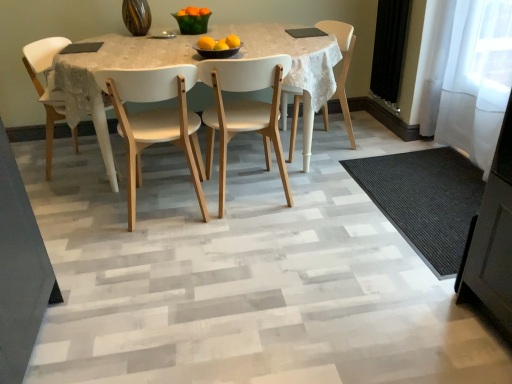
Question: Does point (218, 64) appear closer or farther from the camera than point (49, 107)?

Choices:
 (A) farther
 (B) closer

Answer: (B)

Question: Considering the positions of white wood chair at center, the third chair when ordered from left to right, and white wood chair at left, acting as the 4th chair starting from the right, in the image, is white wood chair at center, the third chair when ordered from left to right, wider or thinner than white wood chair at left, acting as the 4th chair starting from the right,?

Choices:
 (A) wide
 (B) thin

Answer: (A)

Question: Estimate the real-world distances between objects in this image. Which object is farther from the yellow matte/orange at center, arranged as the 1th orange when viewed from the left?

Choices:
 (A) white wood chair at left, acting as the 4th chair starting from the right
 (B) white matte wood chair at center, the third chair viewed from the right
 (C) yellow matte/orange at center, which is the second orange from right to left
 (D) white glossy table at center
 (E) matte black bowl at center

Answer: (A)

Question: Estimate the real-world distances between objects in this image. Which object is closer to the transparent glass door at right?

Choices:
 (A) yellow matte/orange at center, which is the second orange from right to left
 (B) yellow matte/orange at center, arranged as the 1th orange when viewed from the left
 (C) white matte wood chair at center, the third chair viewed from the right
 (D) white wood chair at center, the third chair when ordered from left to right
 (E) orange matte at center, positioned as the first orange in right-to-left order

Answer: (D)